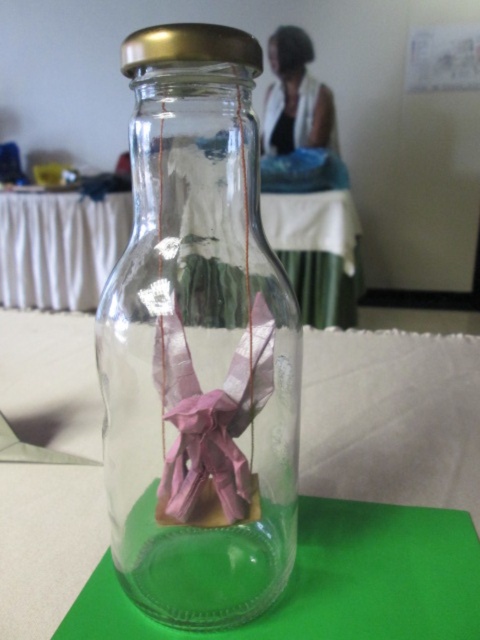
Question: Among these objects, which one is farthest from the camera?

Choices:
 (A) transparent glass table at center
 (B) pink paper ribbon at center

Answer: (A)

Question: Which object is farther from the camera taking this photo?

Choices:
 (A) pink paper ribbon at center
 (B) transparent glass table at center

Answer: (B)

Question: Can you confirm if transparent glass bottle at center is positioned above pink paper ribbon at center?

Choices:
 (A) no
 (B) yes

Answer: (B)

Question: Which is farther from the transparent glass bottle at center?

Choices:
 (A) transparent glass table at center
 (B) pink paper ribbon at center

Answer: (A)

Question: Can you confirm if transparent glass bottle at center is wider than pink paper ribbon at center?

Choices:
 (A) no
 (B) yes

Answer: (B)

Question: Does transparent glass bottle at center appear under transparent glass table at center?

Choices:
 (A) no
 (B) yes

Answer: (B)